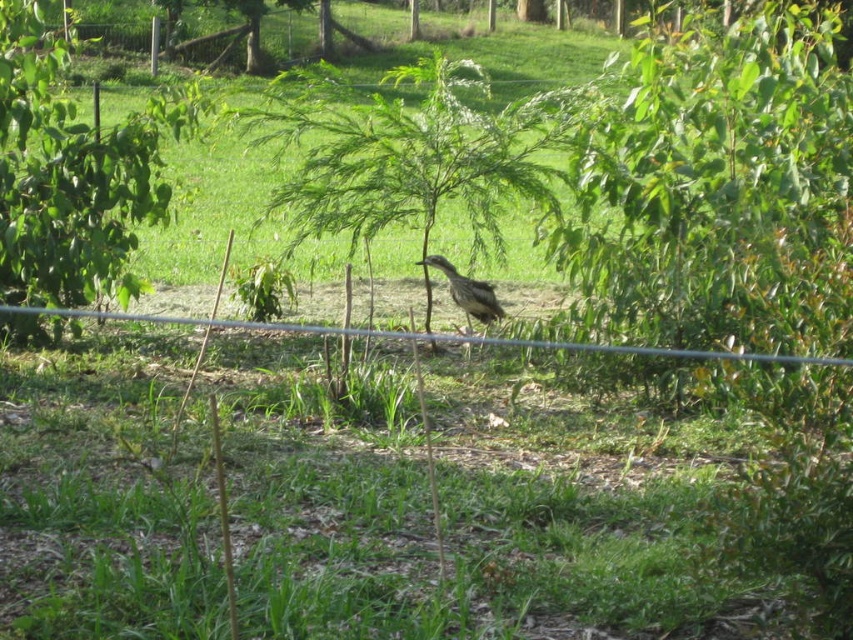
Is point (331, 99) behind point (450, 296)?

Yes, point (331, 99) is behind point (450, 296).

Is green leafy tree at center taller than brown feathered bird at center?

Yes, green leafy tree at center is taller than brown feathered bird at center.

Measure the distance between green leafy tree at center and camera.

The distance of green leafy tree at center from camera is 8.03 meters.

You are a GUI agent. You are given a task and a screenshot of the screen. Output one action in this format:
    pyautogui.click(x=<x>, y=<y>)
    Task: Click on the green leafy tree at center
    The height and width of the screenshot is (640, 853).
    Given the screenshot: What is the action you would take?
    pyautogui.click(x=410, y=152)

Does green leafy tree at left have a greater height compared to brown feathered bird at center?

Correct, green leafy tree at left is much taller as brown feathered bird at center.

Who is more distant from viewer, (152, 102) or (426, 262)?

The point (152, 102) is more distant.

This screenshot has width=853, height=640. What are the coordinates of `green leafy tree at left` in the screenshot? It's located at (68, 177).

Is green leafy tree at center above green leafy tree at left?

Indeed, green leafy tree at center is positioned over green leafy tree at left.

Can you confirm if green leafy tree at center is positioned below green leafy tree at left?

No.

Between point (502, 122) and point (76, 300), which one is positioned in front?

Point (76, 300)

Identify the location of green leafy tree at center. This screenshot has height=640, width=853. (410, 152).